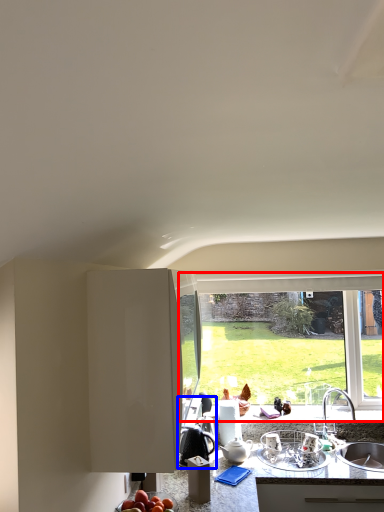
Question: Which point is further to the camera, window (highlighted by a red box) or appliance (highlighted by a blue box)?

Choices:
 (A) window
 (B) appliance

Answer: (A)